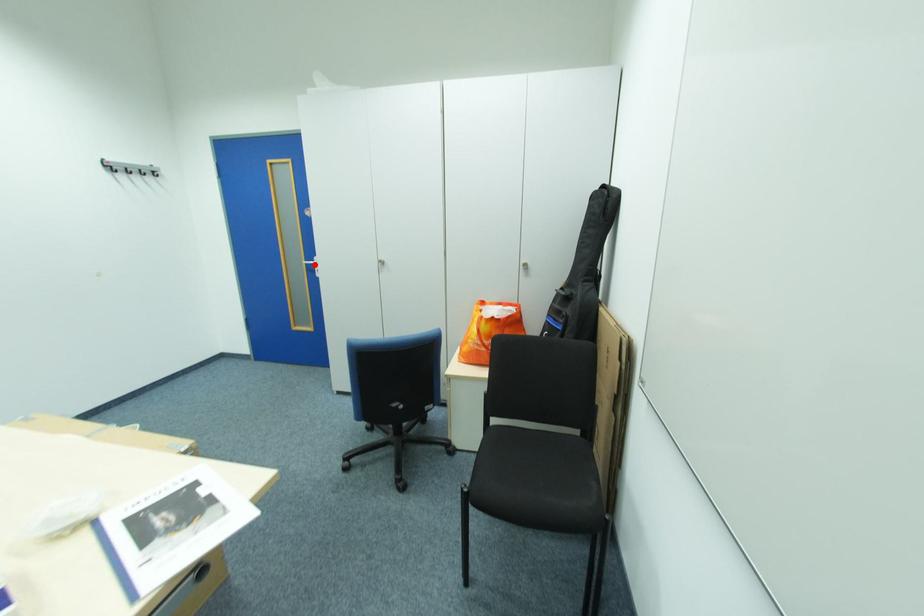
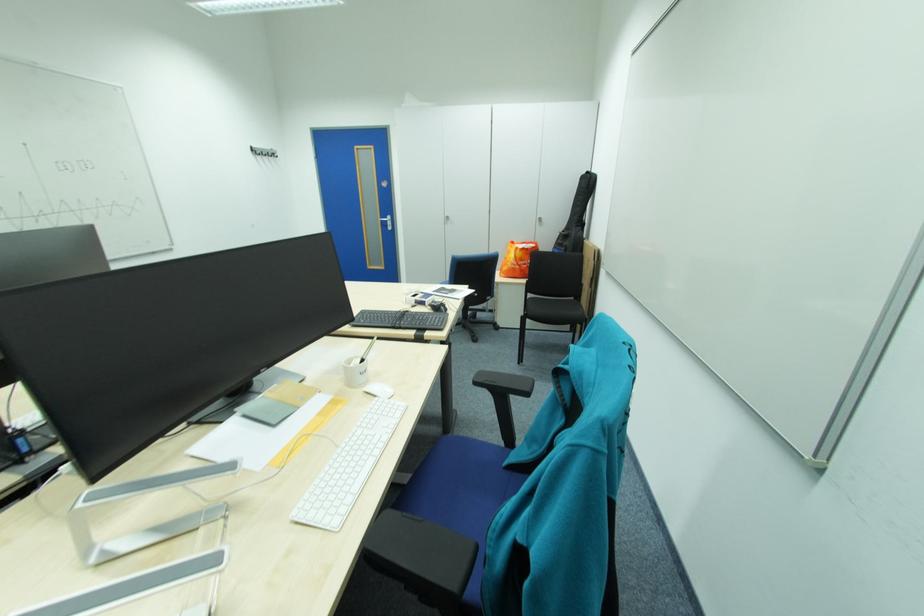
The point at the highlighted location is marked in the first image. Where is the corresponding point in the second image?

(390, 221)